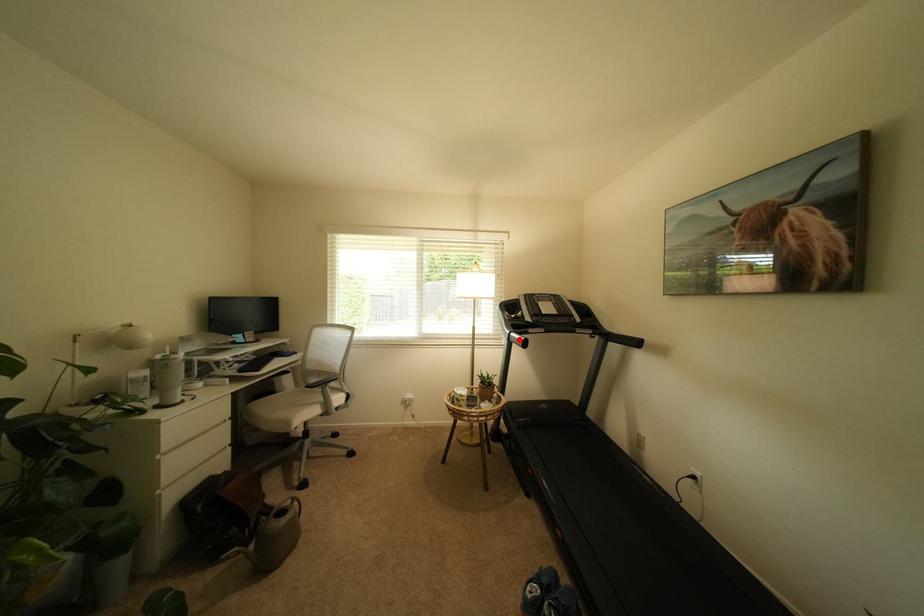
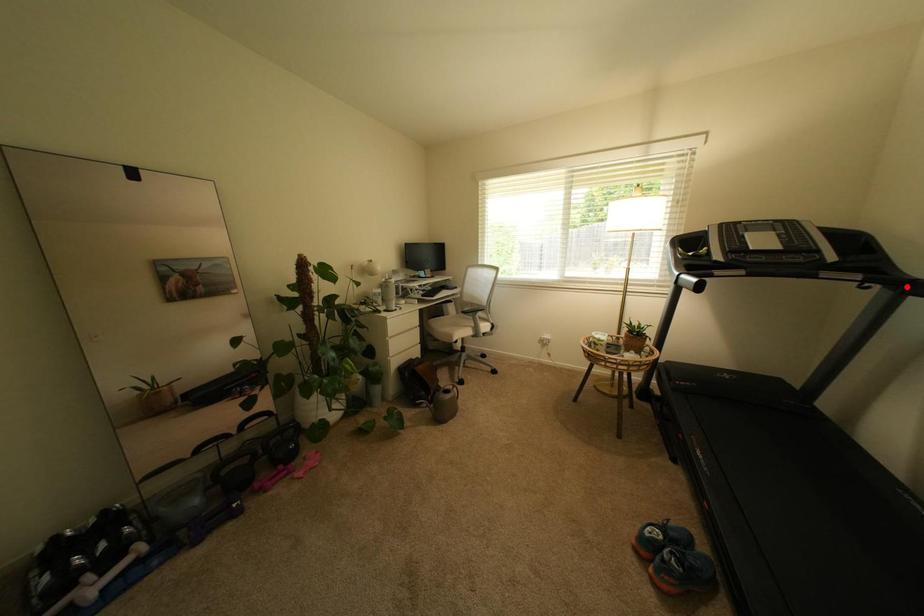
I am providing you with two images of the same scene from different viewpoints. A red point is marked on the first image and another point is marked on the second image. Is the marked point in image1 the same physical position as the marked point in image2?

No